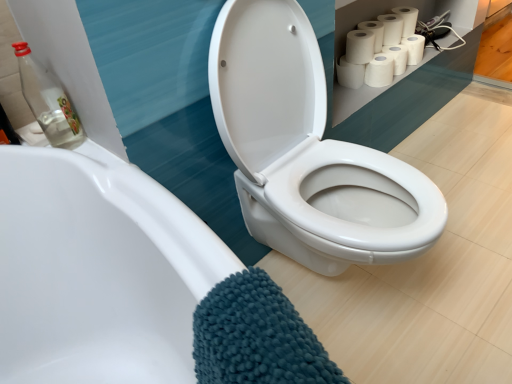
Question: From the image's perspective, does transparent glass bottle at upper left appear lower than teal chenille bath towel at lower left?

Choices:
 (A) yes
 (B) no

Answer: (B)

Question: From a real-world perspective, is transparent glass bottle at upper left positioned over teal chenille bath towel at lower left based on gravity?

Choices:
 (A) yes
 (B) no

Answer: (A)

Question: Is transparent glass bottle at upper left positioned beyond the bounds of teal chenille bath towel at lower left?

Choices:
 (A) yes
 (B) no

Answer: (A)

Question: Considering the relative sizes of transparent glass bottle at upper left and teal chenille bath towel at lower left in the image provided, is transparent glass bottle at upper left smaller than teal chenille bath towel at lower left?

Choices:
 (A) yes
 (B) no

Answer: (A)

Question: Is transparent glass bottle at upper left oriented towards teal chenille bath towel at lower left?

Choices:
 (A) no
 (B) yes

Answer: (B)

Question: From a real-world perspective, is transparent glass bottle at upper left below teal chenille bath towel at lower left?

Choices:
 (A) no
 (B) yes

Answer: (A)

Question: From a real-world perspective, is white matte toilet paper at upper right, acting as the third toilet paper starting from the right, located higher than white matte toilet paper at upper right, which is the first toilet paper from right to left?

Choices:
 (A) no
 (B) yes

Answer: (A)

Question: Can you confirm if white matte toilet paper at upper right, acting as the third toilet paper starting from the right, is positioned to the left of white matte toilet paper at upper right, which is the first toilet paper from right to left?

Choices:
 (A) yes
 (B) no

Answer: (A)

Question: Does white matte toilet paper at upper right, marked as the 5th toilet paper in a left-to-right arrangement, turn towards white matte toilet paper at upper right, the 7th toilet paper when ordered from left to right?

Choices:
 (A) no
 (B) yes

Answer: (A)

Question: Can you confirm if white matte toilet paper at upper right, marked as the 5th toilet paper in a left-to-right arrangement, is taller than white matte toilet paper at upper right, the 7th toilet paper when ordered from left to right?

Choices:
 (A) yes
 (B) no

Answer: (B)

Question: Are white matte toilet paper at upper right, marked as the 5th toilet paper in a left-to-right arrangement, and white matte toilet paper at upper right, the 7th toilet paper when ordered from left to right, far apart?

Choices:
 (A) no
 (B) yes

Answer: (A)

Question: Considering the relative sizes of white matte toilet paper at upper right, acting as the third toilet paper starting from the right, and white matte toilet paper at upper right, which is the first toilet paper from right to left, in the image provided, is white matte toilet paper at upper right, acting as the third toilet paper starting from the right, smaller than white matte toilet paper at upper right, which is the first toilet paper from right to left,?

Choices:
 (A) yes
 (B) no

Answer: (A)

Question: Is white matte toilet paper at upper right, which ranks as the second toilet paper in right-to-left order, taller than white glossy toilet at center?

Choices:
 (A) no
 (B) yes

Answer: (A)